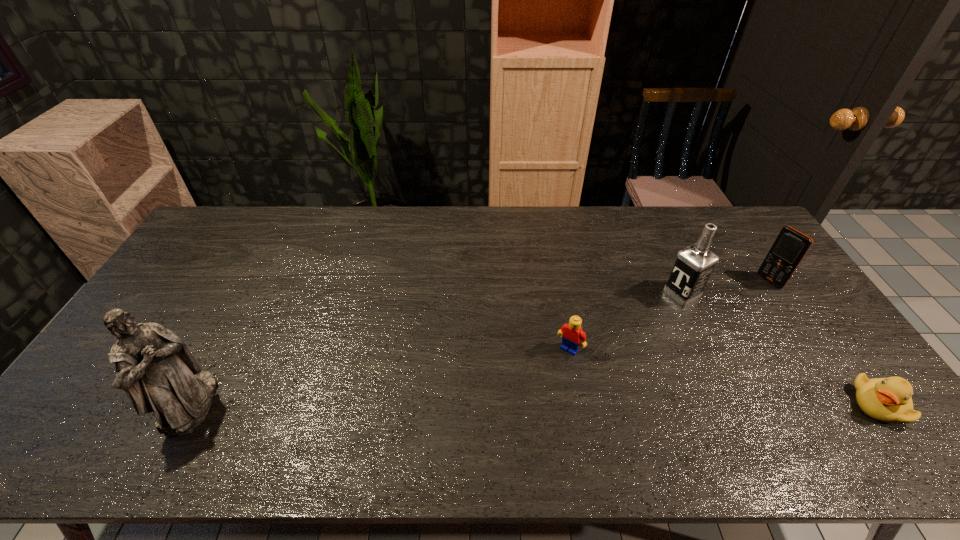
At what (x,y) coordinates should I click in order to perform the action: click on free spot that satisfies the following two spatial constraints: 1. on the front side of the fourth object from right to left; 2. on the front-facing side of the duckling. Please return your answer as a coordinate pair (x, y). This screenshot has height=540, width=960. Looking at the image, I should click on (580, 404).

You are a GUI agent. You are given a task and a screenshot of the screen. Output one action in this format:
    pyautogui.click(x=<x>, y=<y>)
    Task: Click on the free space that satisfies the following two spatial constraints: 1. on the front side of the second shortest object; 2. on the front-facing side of the duckling
    This screenshot has width=960, height=540.
    Given the screenshot: What is the action you would take?
    pyautogui.click(x=580, y=404)